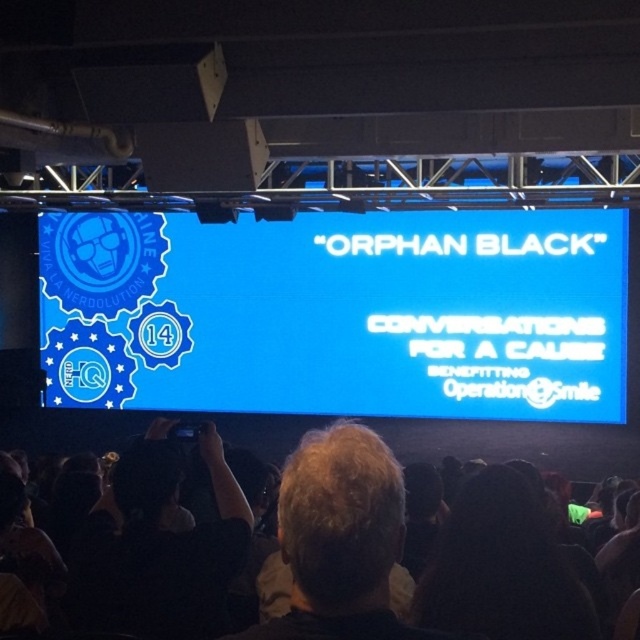
From the picture: You are setting up a photography station for an event. You have a black fabric camera at lower left and a black fabric at lower center. Which object is wider?

The black fabric at lower center is wider than the black fabric camera at lower left.